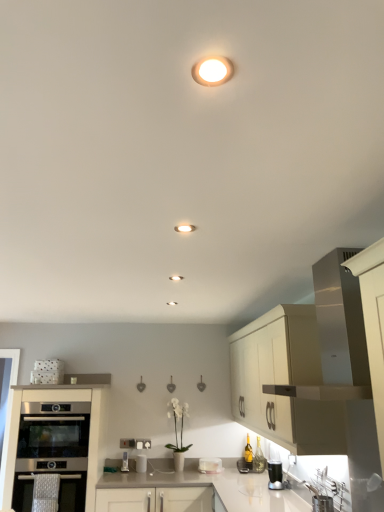
Question: Is white glossy toaster at lower center, placed as the 1th appliance when sorted from right to left, not close to metallic silver toaster at lower center, marked as the 1th appliance in a left-to-right arrangement?

Choices:
 (A) yes
 (B) no

Answer: (B)

Question: Can you confirm if white glossy toaster at lower center, which is the second appliance in left-to-right order, is taller than metallic silver toaster at lower center, arranged as the second appliance when viewed from the right?

Choices:
 (A) no
 (B) yes

Answer: (A)

Question: From the image's perspective, does white glossy toaster at lower center, placed as the 1th appliance when sorted from right to left, appear lower than metallic silver toaster at lower center, arranged as the second appliance when viewed from the right?

Choices:
 (A) yes
 (B) no

Answer: (A)

Question: From a real-world perspective, is white glossy toaster at lower center, which is the second appliance in left-to-right order, located beneath metallic silver toaster at lower center, arranged as the second appliance when viewed from the right?

Choices:
 (A) no
 (B) yes

Answer: (B)

Question: Is white glossy toaster at lower center, placed as the 1th appliance when sorted from right to left, not within metallic silver toaster at lower center, arranged as the second appliance when viewed from the right?

Choices:
 (A) no
 (B) yes

Answer: (B)

Question: From the image's perspective, is matte white recessed light at center, positioned as the 1th lighting in bottom-to-top order, positioned above or below satin silver oven at lower left, positioned as the second cabinetry in right-to-left order?

Choices:
 (A) below
 (B) above

Answer: (B)

Question: Considering the positions of matte white recessed light at center, positioned as the second lighting in right-to-left order, and satin silver oven at lower left, positioned as the second cabinetry in right-to-left order, in the image, is matte white recessed light at center, positioned as the second lighting in right-to-left order, bigger or smaller than satin silver oven at lower left, positioned as the second cabinetry in right-to-left order,?

Choices:
 (A) big
 (B) small

Answer: (B)

Question: From their relative heights in the image, would you say matte white recessed light at center, which is counted as the 1th lighting, starting from the left, is taller or shorter than satin silver oven at lower left, acting as the first cabinetry starting from the left?

Choices:
 (A) short
 (B) tall

Answer: (A)

Question: Is point (178, 229) positioned closer to the camera than point (51, 387)?

Choices:
 (A) farther
 (B) closer

Answer: (B)

Question: From the image's perspective, is stainless steel oven at lower left, which is the 2th oven in bottom-to-top order, above or below white glossy toaster at lower center, which is the second appliance in left-to-right order?

Choices:
 (A) below
 (B) above

Answer: (B)

Question: Is stainless steel oven at lower left, the 1th oven from the top, in front of or behind white glossy toaster at lower center, placed as the 1th appliance when sorted from right to left, in the image?

Choices:
 (A) behind
 (B) front

Answer: (B)

Question: From a real-world perspective, is stainless steel oven at lower left, the 1th oven from the top, physically located above or below white glossy toaster at lower center, placed as the 1th appliance when sorted from right to left?

Choices:
 (A) above
 (B) below

Answer: (A)

Question: Do you think stainless steel oven at lower left, the 1th oven from the top, is within white glossy toaster at lower center, placed as the 1th appliance when sorted from right to left, or outside of it?

Choices:
 (A) outside
 (B) inside

Answer: (A)

Question: Considering the positions of point [x=203, y=71] and point [x=183, y=225], is point [x=203, y=71] closer or farther from the camera than point [x=183, y=225]?

Choices:
 (A) closer
 (B) farther

Answer: (A)

Question: Is matte white light fixture at upper center, marked as the 2th lighting in a left-to-right arrangement, bigger or smaller than matte white recessed light at center, positioned as the second lighting in right-to-left order?

Choices:
 (A) small
 (B) big

Answer: (B)